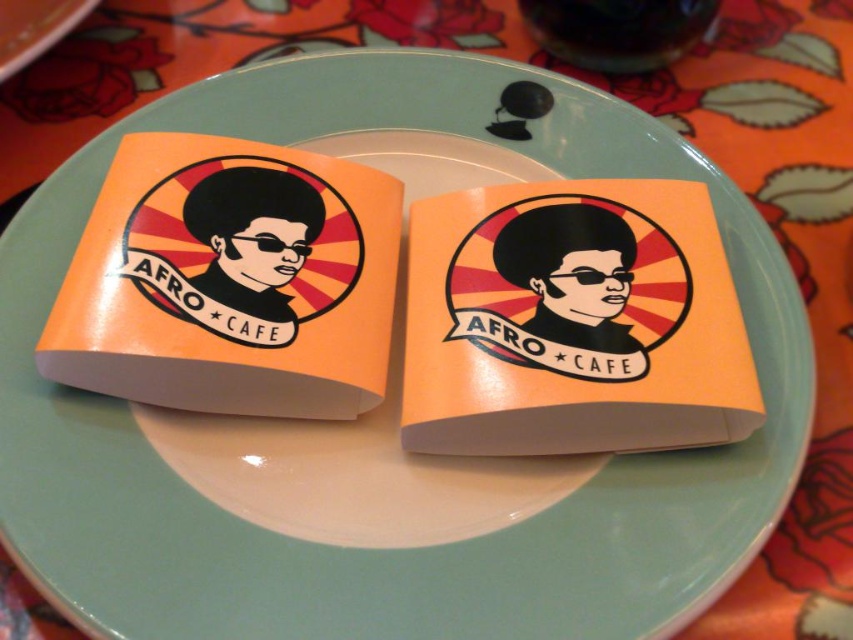
From the picture: You are a customer at Afro Cafe and you see two orange stickers on your plate. The stickers are labeled as orange matte sticker at center and orange glossy sticker at center. You want to place a small spoon between them. Can the spoon, which is 12 inches long, fit between the two stickers?

The orange matte sticker at center and orange glossy sticker at center are 11.37 inches apart. Since the spoon is 12 inches long, it cannot fit between them as the distance between the stickers is shorter than the spoon.

You are a customer at Afro Cafe and see the plate with both the orange glossy sticker at center and the orange paper napkin at center. Which item is closer to the right edge of the plate?

The orange glossy sticker at center is positioned on the right side of the orange paper napkin at center, so it is closer to the right edge of the plate.

You are a customer at Afro Cafe and you see the orange matte sticker at center and the orange paper napkin at center on the plate. Which object is bigger?

The orange matte sticker at center is larger in size than the orange paper napkin at center.